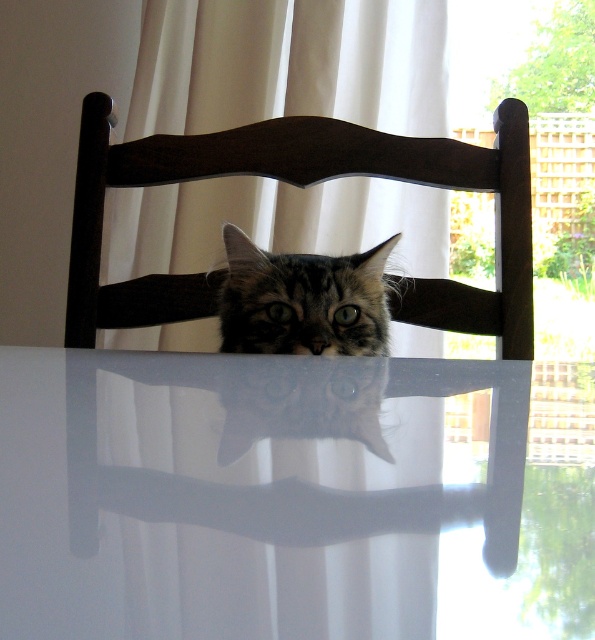
Does white glossy table at center have a smaller size compared to tabby fur cat at center?

Actually, white glossy table at center might be larger than tabby fur cat at center.

You are a GUI agent. You are given a task and a screenshot of the screen. Output one action in this format:
    pyautogui.click(x=<x>, y=<y>)
    Task: Click on the white glossy table at center
    
    Given the screenshot: What is the action you would take?
    pyautogui.click(x=248, y=496)

This screenshot has height=640, width=595. In order to click on white glossy table at center in this screenshot , I will do `click(248, 496)`.

Does dark wood chair at center have a smaller size compared to tabby fur cat at center?

Incorrect, dark wood chair at center is not smaller in size than tabby fur cat at center.

Does dark wood chair at center appear on the left side of tabby fur cat at center?

Correct, you'll find dark wood chair at center to the left of tabby fur cat at center.

Who is more forward, (512, 156) or (264, 266)?

Point (264, 266)

Image resolution: width=595 pixels, height=640 pixels. In order to click on dark wood chair at center in this screenshot , I will do [x=302, y=186].

Between point (311, 522) and point (167, 147), which one is positioned behind?

The point (167, 147) is behind.

Is white glossy table at center below dark wood chair at center?

Correct, white glossy table at center is located below dark wood chair at center.

Does point (308, 392) come farther from viewer compared to point (322, 150)?

No, (308, 392) is in front of (322, 150).

This screenshot has height=640, width=595. I want to click on white glossy table at center, so click(248, 496).